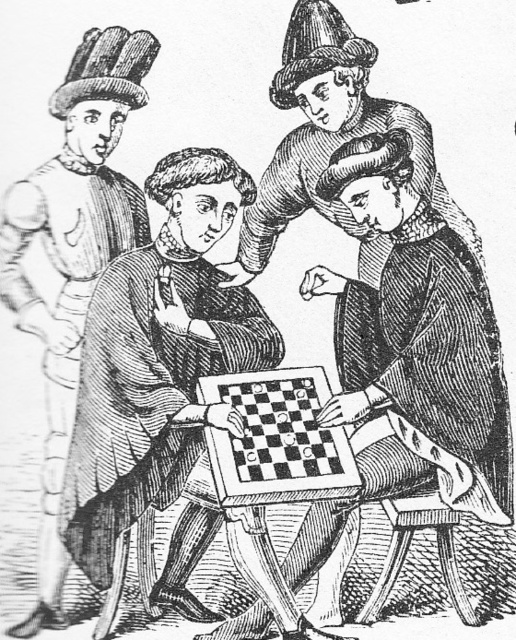
You are a tailor observing the scene and need to determine if the smooth leather hat at left can be placed inside the black wood chessboard at center without folding. Can it fit?

The smooth leather hat at left is thinner than the black wood chessboard at center, so it can fit inside without folding.

You are a historian analyzing this historical chess scene. You notice two objects of interest, the smooth brown robe at center and the smooth leather hat at left. Based on their positions, which object is located to the right of the other?

The smooth brown robe at center is positioned on the right side of smooth leather hat at left.